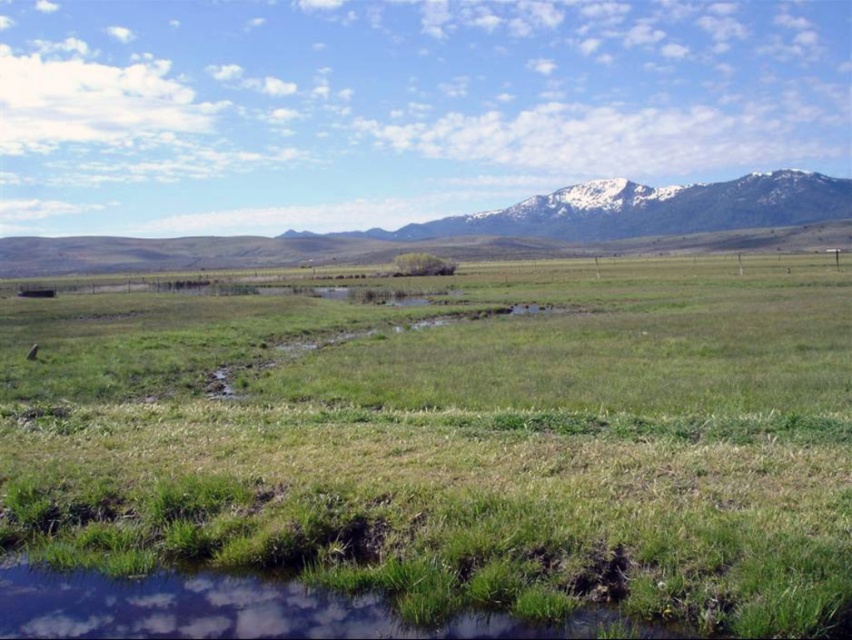
Does green grassy field at center have a greater height compared to snowy rock mountain range at upper right?

Incorrect, green grassy field at center's height is not larger of snowy rock mountain range at upper right's.

Is point (168, 545) farther from camera compared to point (602, 198)?

No, (168, 545) is in front of (602, 198).

Where is `green grassy field at center`? This screenshot has width=852, height=640. green grassy field at center is located at coordinates (435, 451).